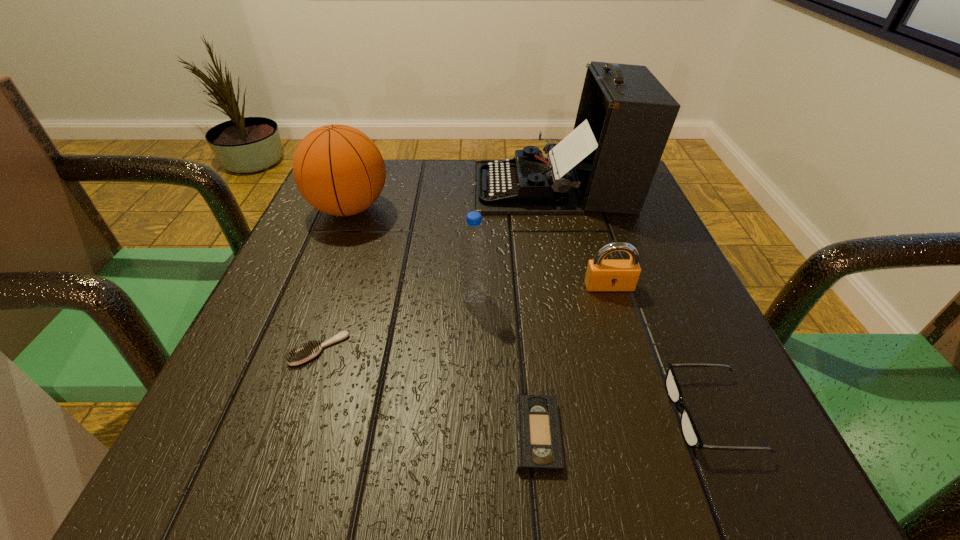
Find the location of `object that is positioned at the near right corner`. object that is positioned at the near right corner is located at coordinates (690, 433).

In the image, there is a desktop. Where is `vacant space at the far edge`? vacant space at the far edge is located at coordinates (473, 174).

The image size is (960, 540). Find the location of `vacant space at the near edge of the desktop`. vacant space at the near edge of the desktop is located at coordinates (336, 437).

In the image, there is a desktop. Where is `free region at the left edge`? free region at the left edge is located at coordinates (226, 386).

In the image, there is a desktop. Where is `vacant area at the right edge`? vacant area at the right edge is located at coordinates (680, 319).

The height and width of the screenshot is (540, 960). I want to click on free spot between the tallest object and the spectacles, so click(x=633, y=301).

The height and width of the screenshot is (540, 960). I want to click on free area in between the shortest object and the second shortest object, so click(428, 392).

The height and width of the screenshot is (540, 960). What are the coordinates of `unoccupied area between the videotape and the scrubbing brush` in the screenshot? It's located at (428, 392).

Find the location of a particular element. empty location between the sixth tallest object and the shortest object is located at coordinates (428, 392).

At what (x,y) coordinates should I click in order to perform the action: click on free space between the videotape and the third nearest object. Please return your answer as a coordinate pair (x, y). The image size is (960, 540). Looking at the image, I should click on (428, 392).